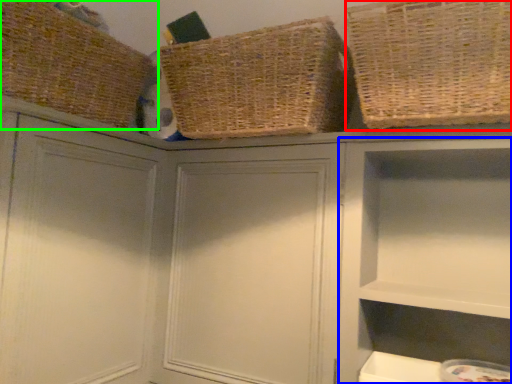
Question: Considering the real-world distances, which object is closest to basket (highlighted by a red box)? cabinet (highlighted by a blue box) or basket (highlighted by a green box).

Choices:
 (A) cabinet
 (B) basket

Answer: (A)